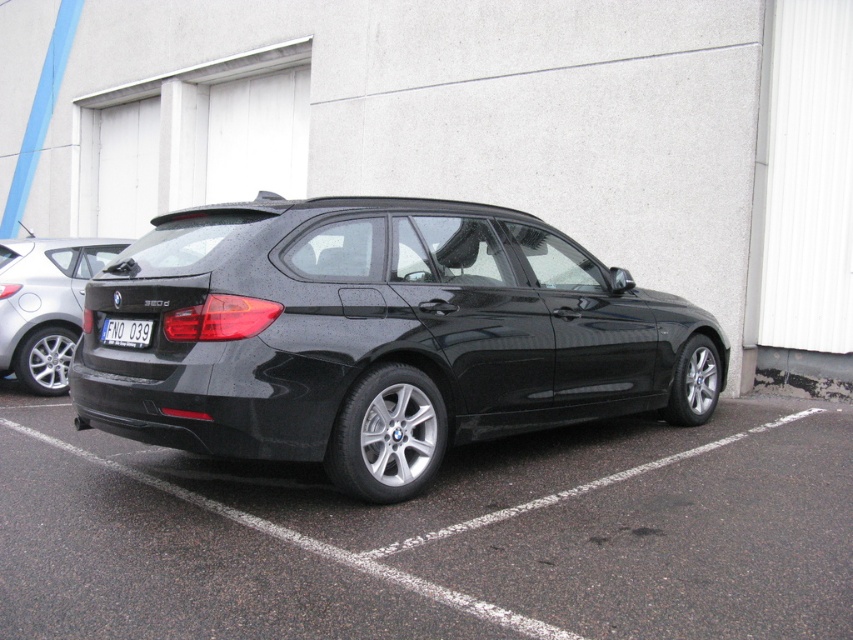
You are a parking attendant and need to ensure that the matte black car at lower left and the black plastic license plate at center are properly aligned according to parking regulations. Which object should be on the left side to comply with the regulations?

The matte black car at lower left is positioned on the left side of the black plastic license plate at center, so it is already aligned correctly according to parking regulations.

You are a delivery driver who needs to park your truck in the parking lot. The truck is as long as the glossy black car at center. Can you safely park your truck in the black rubber parking lot at lower right without overhanging the lines?

The black rubber parking lot at lower right is shorter than the glossy black car at center. Since your truck is as long as the glossy black car at center, it will not fit in the black rubber parking lot at lower right without overhanging the lines.

Based on the photo, you are a delivery driver who needs to park your van in the parking lot. The parking lot has a maximum vehicle length of 6 meters. Your van is 5.8 meters long. Can you safely park your van in the black rubber parking lot at lower right?

The black rubber parking lot at lower right has a maximum vehicle length capacity of 6 meters. Since your van is 5.8 meters long, which is under the limit, you can safely park your van there.